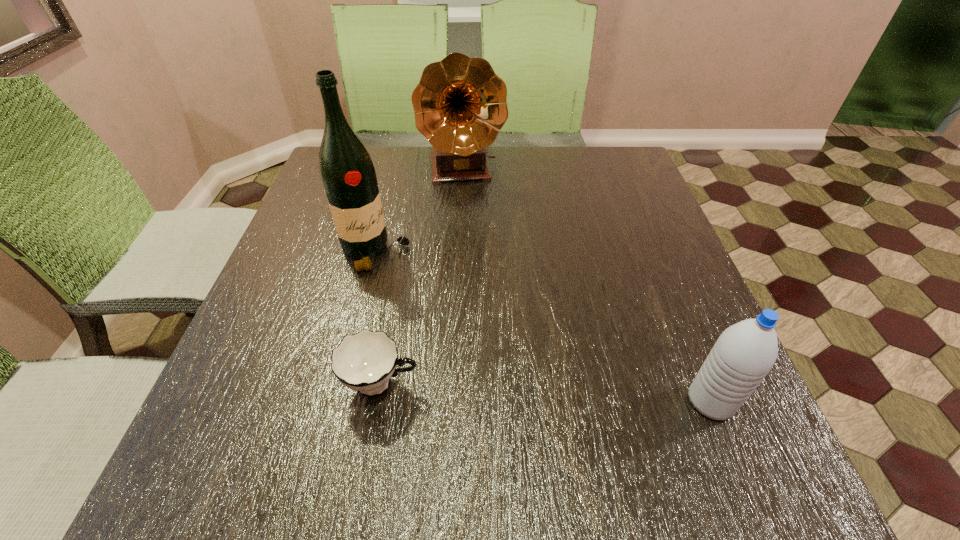
The width and height of the screenshot is (960, 540). What are the coordinates of `vacant space on the desktop that is between the shortest object and the water bottle and is positioned on the horn of the third shortest object` in the screenshot? It's located at (502, 390).

Locate an element on the screen. The height and width of the screenshot is (540, 960). free spot on the desktop that is between the cup and the water bottle and is positioned on the surface of the wine bottle is located at coordinates (531, 392).